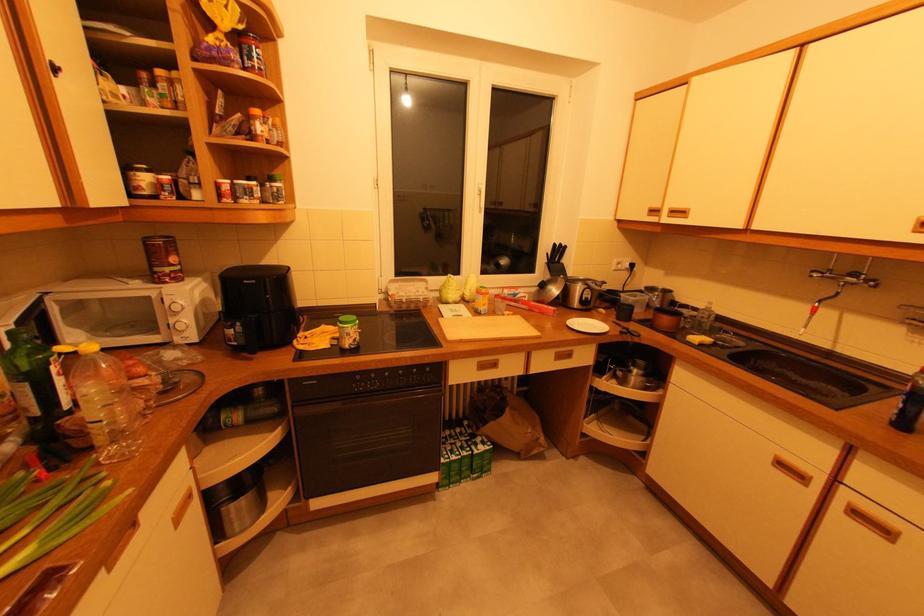
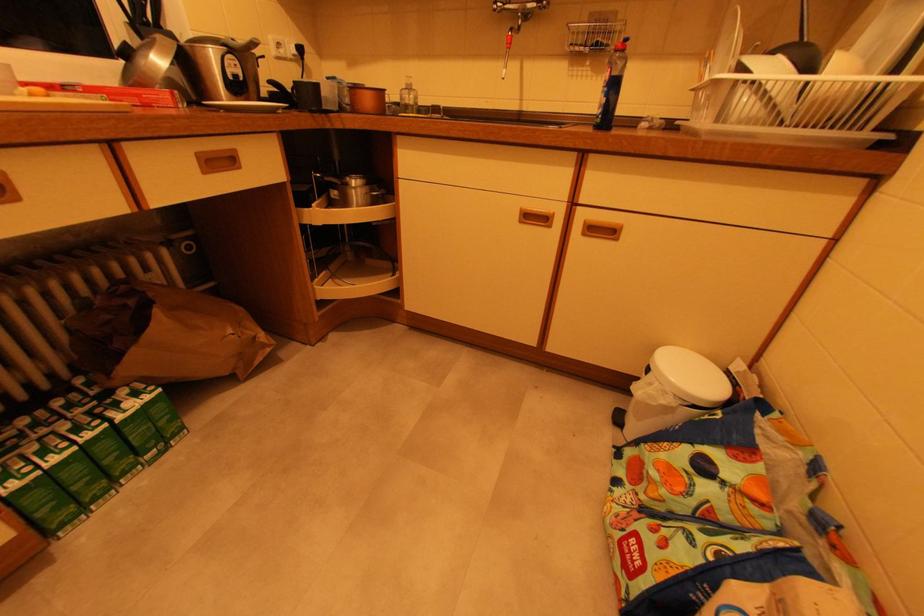
The images are taken continuously from a first-person perspective. In which direction is your viewpoint rotating?

The camera's rotation is toward right-down.